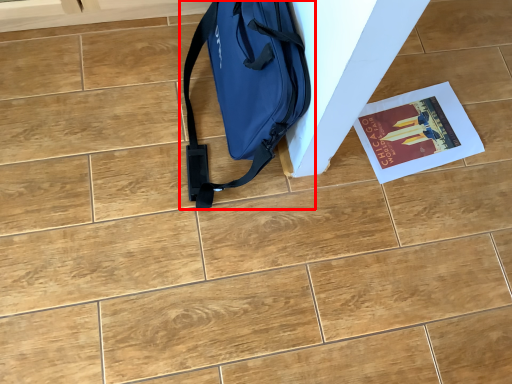
Question: Where is luggage and bags (annotated by the red box) located in relation to magazine in the image?

Choices:
 (A) left
 (B) right

Answer: (A)